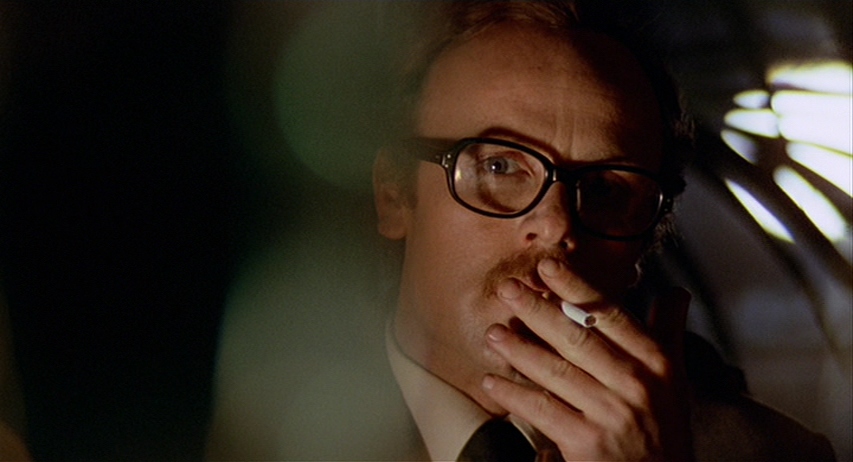
Locate an element on the screen. light shining on wall is located at coordinates (815, 73), (815, 117), (821, 169), (811, 199), (751, 221), (758, 120).